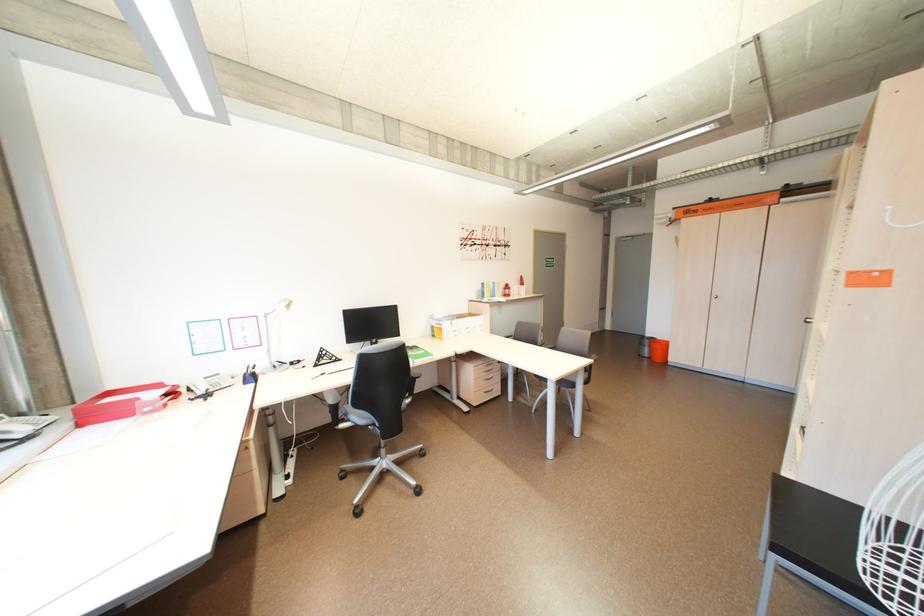
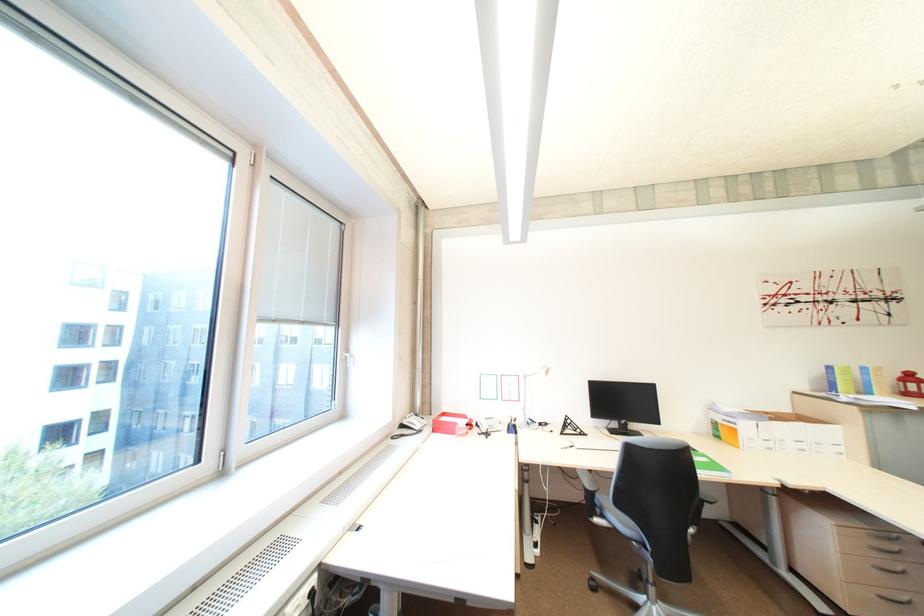
Locate, in the second image, the point that corresponds to (x=436, y=355) in the first image.

(725, 468)